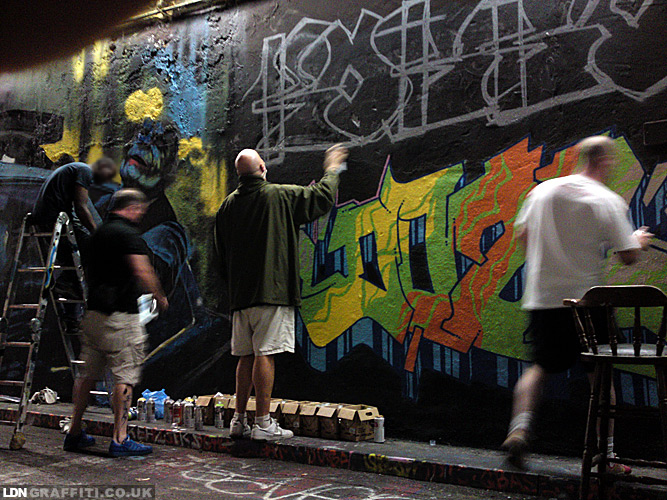
You are a GUI agent. You are given a task and a screenshot of the screen. Output one action in this format:
    pyautogui.click(x=<x>, y=<y>)
    Task: Click on the small boxes
    This screenshot has height=500, width=667.
    Given the screenshot: What is the action you would take?
    pyautogui.click(x=360, y=422), pyautogui.click(x=327, y=419), pyautogui.click(x=309, y=419), pyautogui.click(x=291, y=415), pyautogui.click(x=271, y=410), pyautogui.click(x=249, y=408), pyautogui.click(x=229, y=404), pyautogui.click(x=221, y=404), pyautogui.click(x=205, y=403)